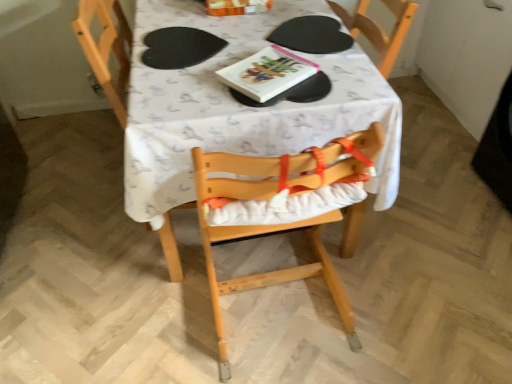
At what (x,y) coordinates should I click in order to perform the action: click on vacant space underneath natural wood highchair at center (from a real-world perspective). Please return your answer as a coordinate pair (x, y). Image resolution: width=512 pixels, height=384 pixels. Looking at the image, I should click on (282, 310).